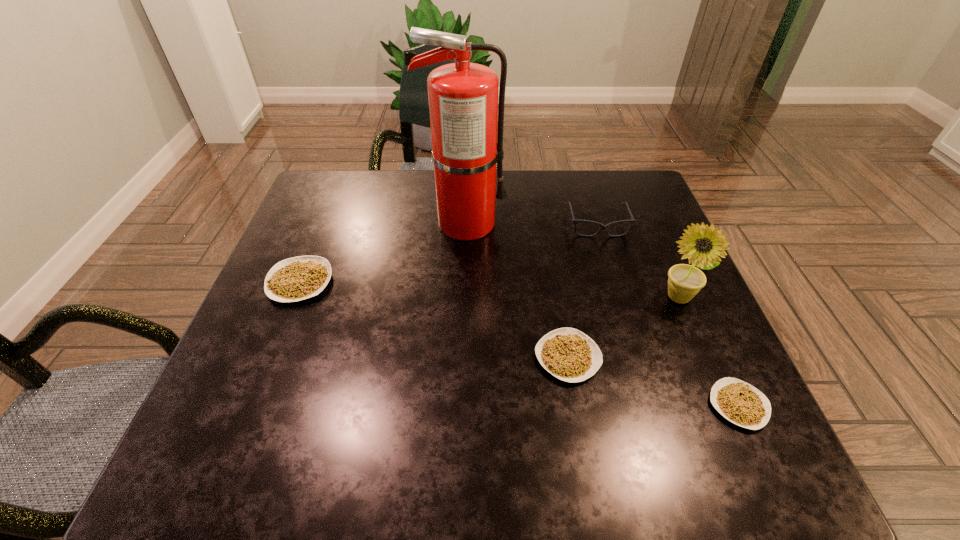
Where is `vacant space located on the back of the leftmost object`? vacant space located on the back of the leftmost object is located at coordinates (345, 172).

At what (x,y) coordinates should I click in order to perform the action: click on vacant space situated 0.090m on the back of the second tallest legume. Please return your answer as a coordinate pair (x, y). This screenshot has height=540, width=960. Looking at the image, I should click on (558, 299).

Identify the location of vacant space located on the left of the shortest legume. (564, 406).

The height and width of the screenshot is (540, 960). I want to click on vacant space located 0.340m at the nozzle of the second object from left to right, so click(x=636, y=223).

Find the location of a particular element. vacant space located 0.360m on the front-facing side of the third tallest object is located at coordinates (638, 360).

Where is `free region located on the face of the fifth shortest object`? Image resolution: width=960 pixels, height=540 pixels. free region located on the face of the fifth shortest object is located at coordinates (726, 410).

This screenshot has height=540, width=960. Find the location of `fire extinguisher that is at the far edge`. fire extinguisher that is at the far edge is located at coordinates (463, 97).

You are a GUI agent. You are given a task and a screenshot of the screen. Output one action in this format:
    pyautogui.click(x=<x>, y=<y>)
    Task: Click on the spectacles that is at the far edge
    This screenshot has width=960, height=540.
    Given the screenshot: What is the action you would take?
    tap(602, 227)

Identify the location of object that is at the left edge. (298, 278).

Find the location of `legume that is at the right edge`. legume that is at the right edge is located at coordinates (739, 402).